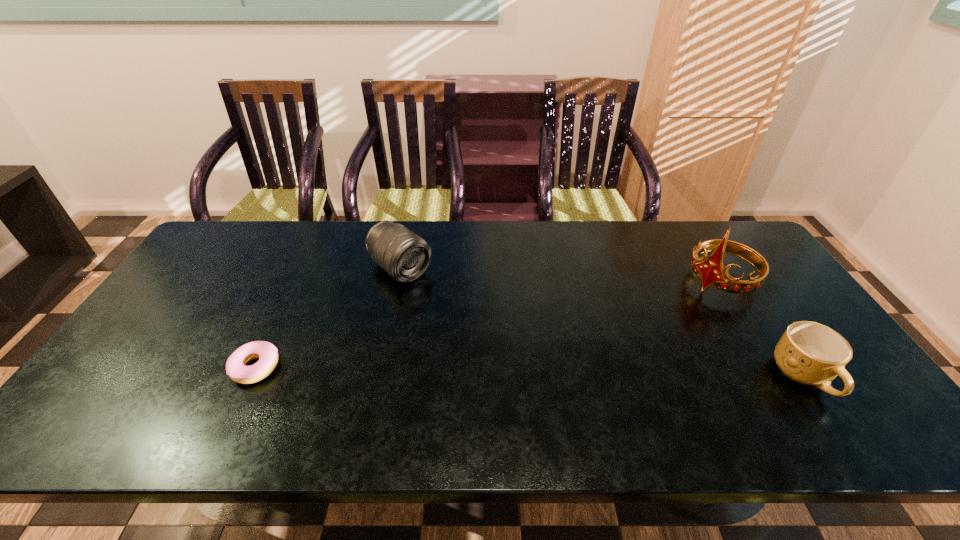
What are the coordinates of `free spot on the desktop that is between the doughnut and the mug and is positioned on the front-facing side of the tiara` in the screenshot? It's located at (583, 373).

Locate an element on the screen. vacant spot on the desktop that is between the shortest object and the second shortest object and is positioned on the surface of the third object from right to left is located at coordinates (529, 372).